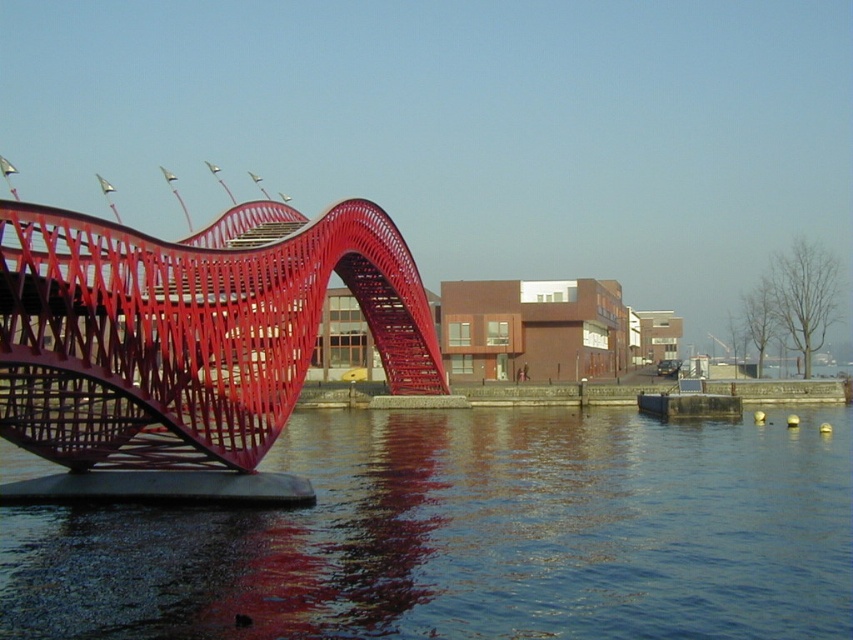
You are a photographer planning to capture the metallic red bridge at left and the glossy water at lower left in a single frame. Given their sizes, which object should you focus on to ensure both are clearly visible in the photo?

The glossy water at lower left has a smaller size compared to the metallic red bridge at left, so focusing on the metallic red bridge at left would allow both objects to be clearly visible in the photo since it is larger and can be centered while the smaller glossy water at lower left would still fit within the frame.

In the scene with the modern red bridge over water and buildings in the background, there is a point labeled as point (469, 536). What does this point represent?

The point (469, 536) corresponds to glossy water at lower left.

You are standing on the shore and see the metallic red bridge at left and the glossy water at lower left. Which object is positioned lower in the scene?

The glossy water at lower left is located below the metallic red bridge at left, so it is positioned lower in the scene.